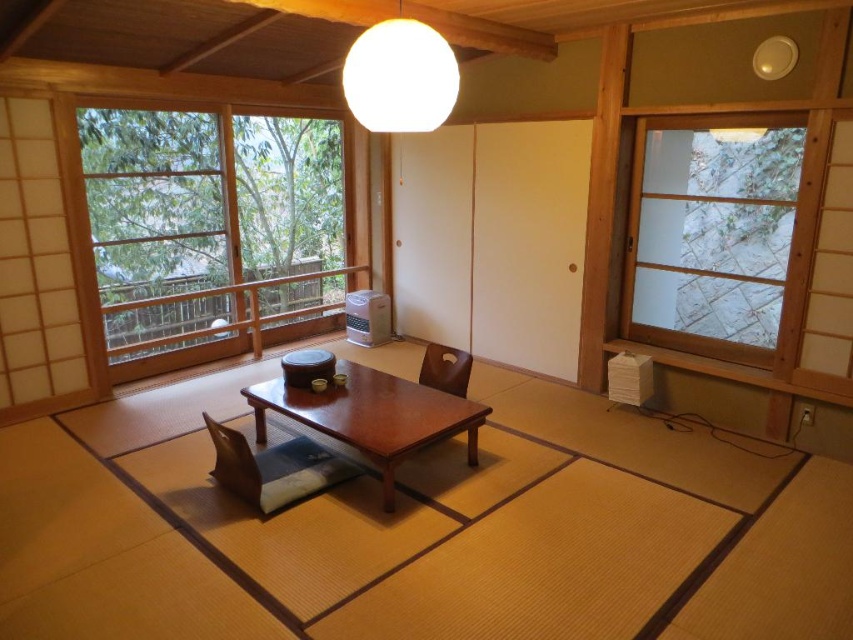
Is white matte sphere at upper center below wooden chair at center?

Actually, white matte sphere at upper center is above wooden chair at center.

Which is behind, point (398, 19) or point (219, 470)?

The point (219, 470) is behind.

The height and width of the screenshot is (640, 853). I want to click on white matte sphere at upper center, so click(399, 76).

Looking at this image, can you confirm if white matte sphere at upper center is thinner than brown leather chair at center?

In fact, white matte sphere at upper center might be wider than brown leather chair at center.

Based on the photo, can you confirm if white matte sphere at upper center is shorter than brown leather chair at center?

No.

Locate an element on the screen. The height and width of the screenshot is (640, 853). white matte sphere at upper center is located at coordinates (399, 76).

At what (x,y) coordinates should I click in order to perform the action: click on white matte sphere at upper center. Please return your answer as a coordinate pair (x, y). Looking at the image, I should click on (399, 76).

Which is in front, point (444, 387) or point (448, 360)?

Point (444, 387)

Identify the location of brown matte chair at center. Image resolution: width=853 pixels, height=640 pixels. (445, 369).